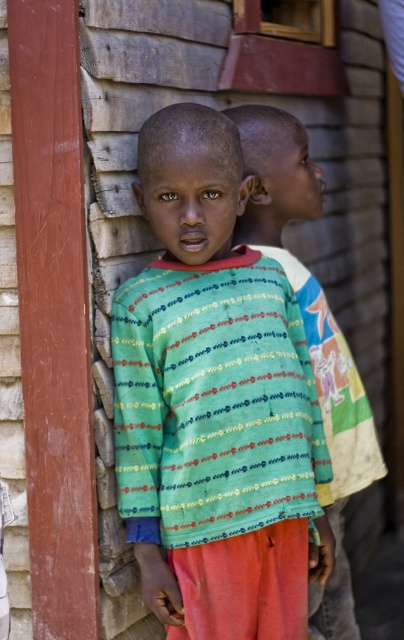
Is multicolored printed shirt at center below multicolored fabric shirt at center?

Actually, multicolored printed shirt at center is above multicolored fabric shirt at center.

Who is positioned more to the right, multicolored printed shirt at center or multicolored fabric shirt at center?

From the viewer's perspective, multicolored fabric shirt at center appears more on the right side.

Does point (183, 188) come in front of point (309, 296)?

Yes.

The image size is (404, 640). Find the location of `multicolored printed shirt at center`. multicolored printed shirt at center is located at coordinates coord(214,403).